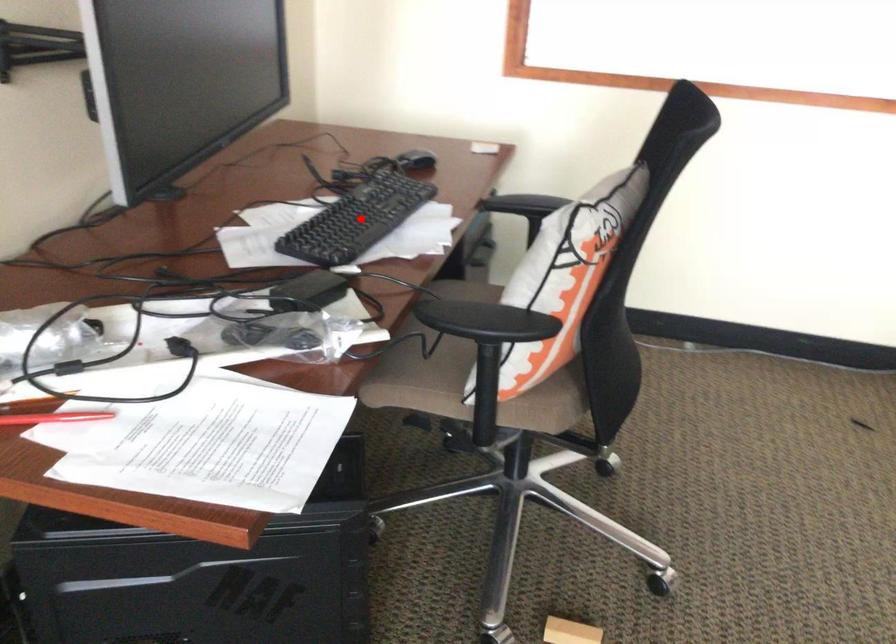
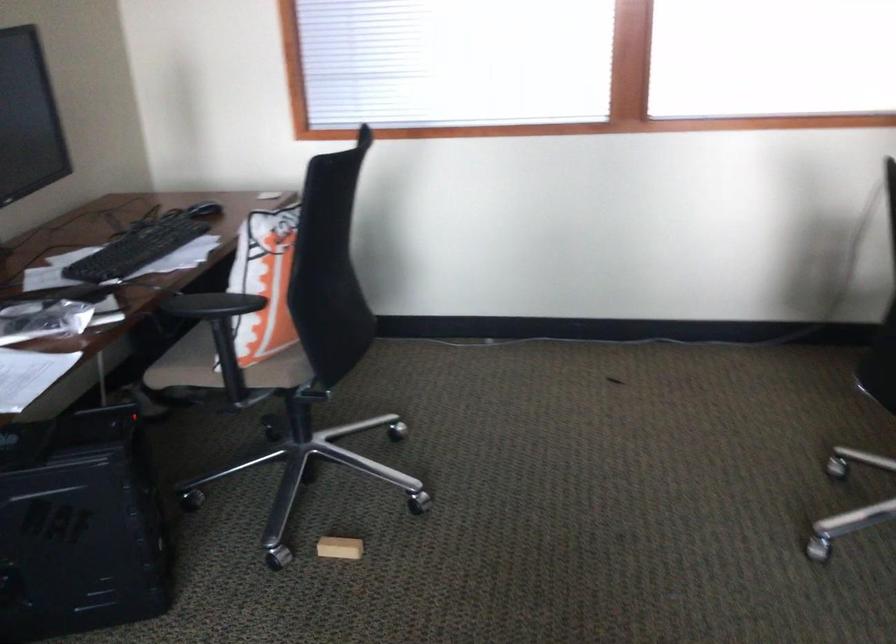
Question: I am providing you with two images of the same scene from different viewpoints. Given a red point in image1, look at the same physical point in image2. Is it:

Choices:
 (A) Closer to the viewpoint
 (B) Farther from the viewpoint

Answer: (B)